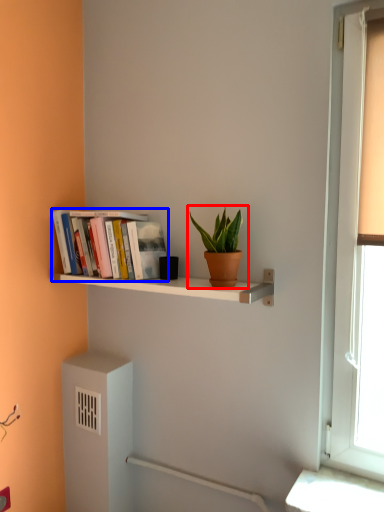
Question: Which object is further to the camera taking this photo, houseplant (highlighted by a red box) or book (highlighted by a blue box)?

Choices:
 (A) houseplant
 (B) book

Answer: (B)